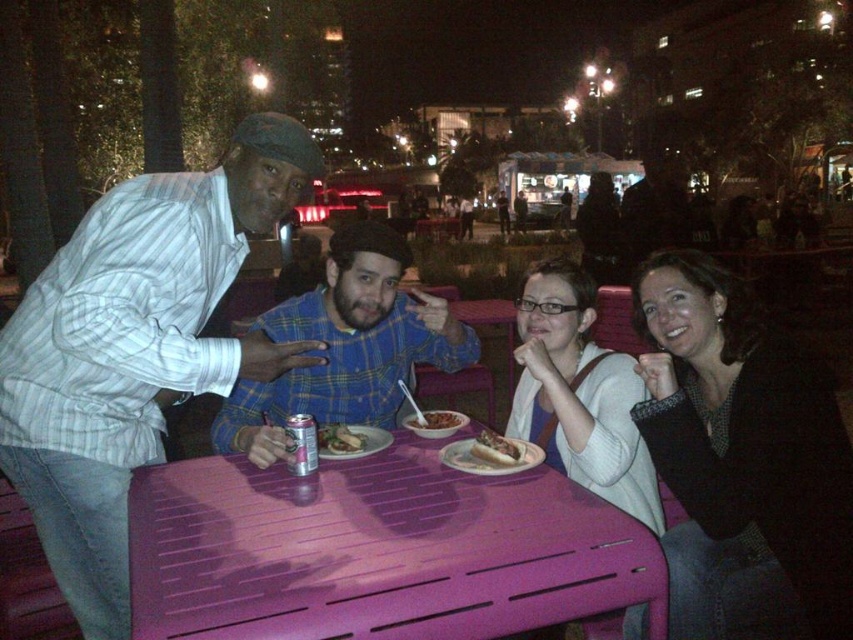
You are a photographer at the park and want to capture both the matte black jacket at lower right and the blue plaid shirt at center in a single frame. Given their sizes, which one might you need to position closer to the camera to ensure both appear equally sized in the photo?

Since the matte black jacket at lower right is smaller than the blue plaid shirt at center, you should position the matte black jacket at lower right closer to the camera to make them appear the same size in the photo.

You are a food delivery person who needs to place a hot meal on the table without touching any existing items. The table has a white sweater at center and a smooth brown rice bowl at center. Which item should you place the meal on top of to ensure it stays elevated?

The white sweater at center is much taller than the smooth brown rice bowl at center, so placing the meal on top of the white sweater at center would keep it elevated.

From the picture: You are a photographer standing at the edge of the dining area. You want to take a photo of the blue plaid shirt at center and the matte black jacket at lower right without any obstructions. Based on their positions, which subject should you focus on first to ensure both are in frame?

The matte black jacket at lower right is positioned under the blue plaid shirt at center. To capture both without obstruction, focus on the blue plaid shirt at center first as it is above and ensure the matte black jacket at lower right is visible beneath it.